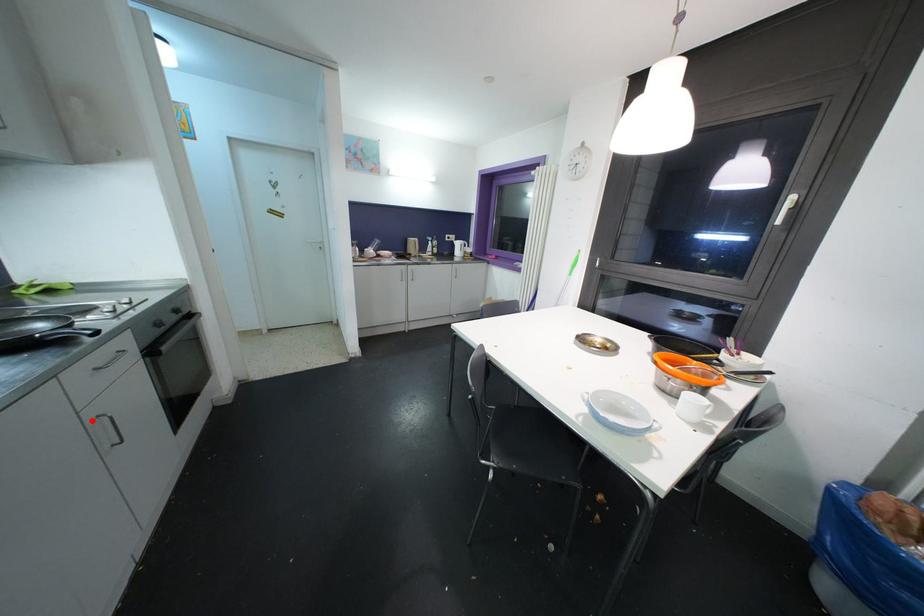
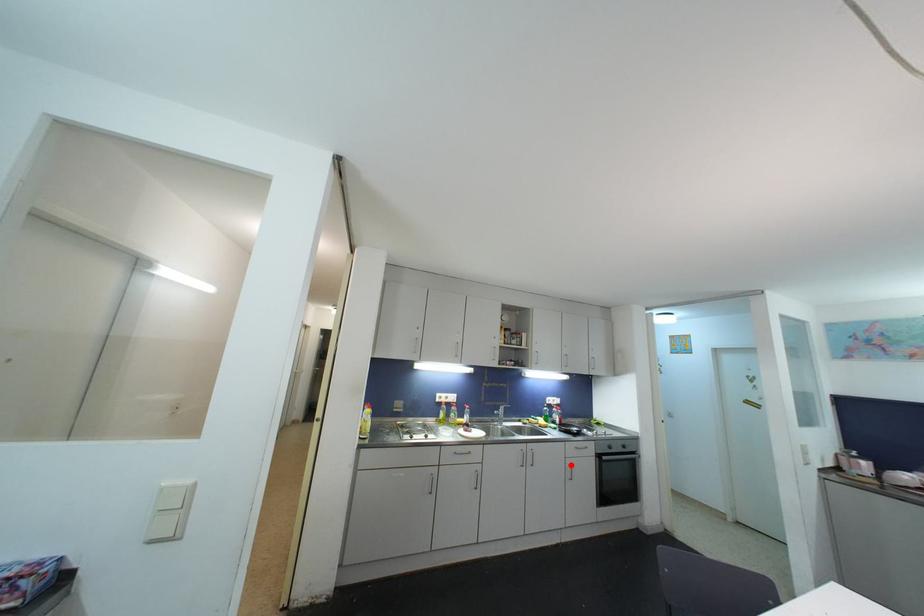
I am providing you with two images of the same scene from different viewpoints. A red point is marked on the first image and another point is marked on the second image. Is the marked point in image1 the same physical position as the marked point in image2?

Yes